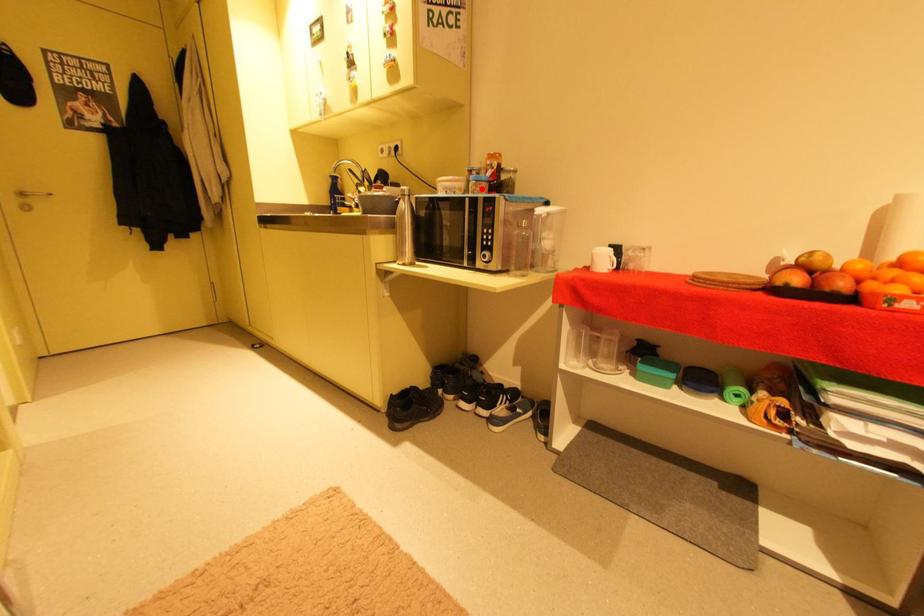
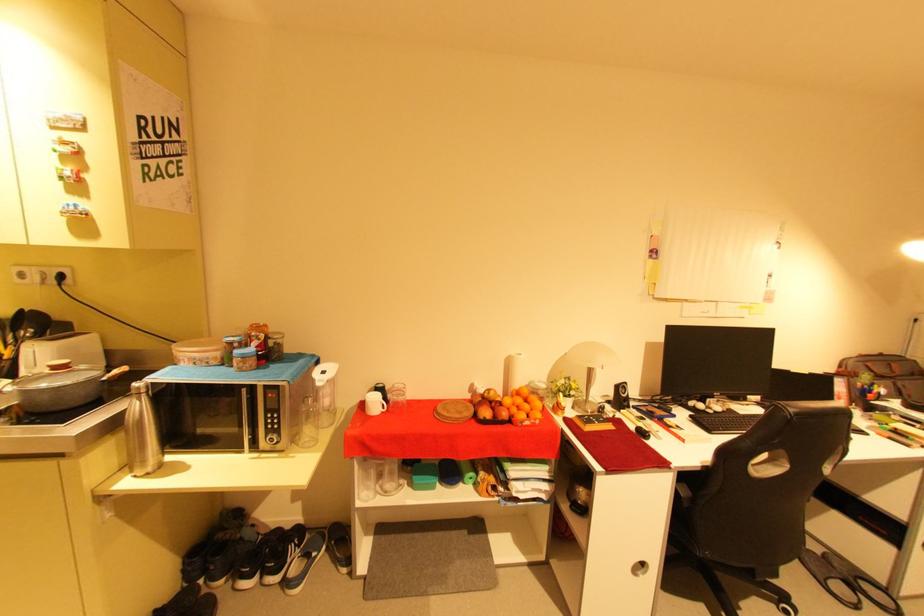
The point at the highlighted location is marked in the first image. Where is the corresponding point in the second image?

(249, 365)